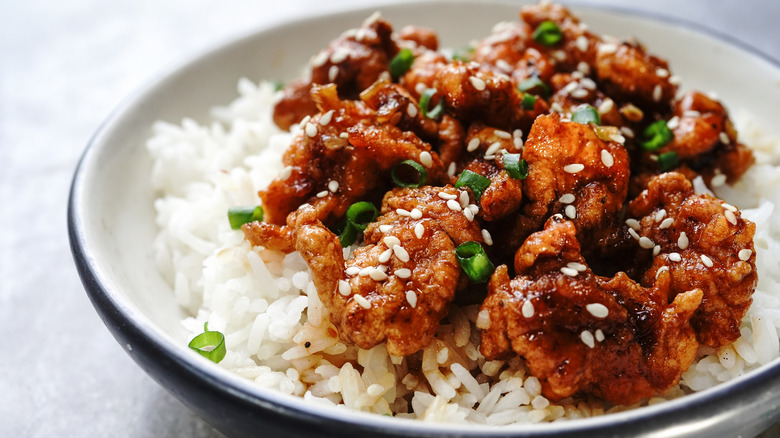
I want to click on plate, so click(126, 233).